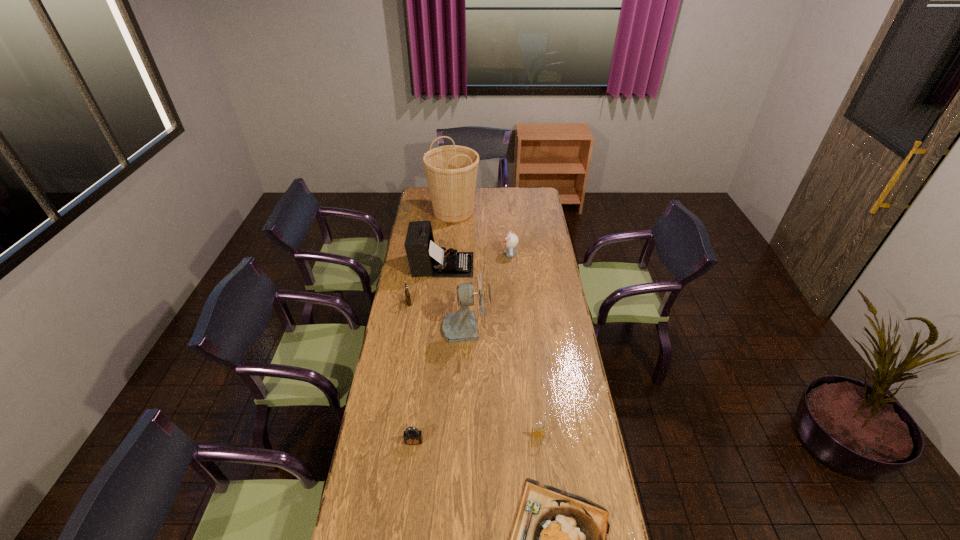
The image size is (960, 540). I want to click on typewriter positioned at the left edge, so click(425, 258).

This screenshot has height=540, width=960. In order to click on object that is at the far left corner in this screenshot , I will do `click(451, 170)`.

Where is `vacant region at the left edge`? Image resolution: width=960 pixels, height=540 pixels. vacant region at the left edge is located at coordinates (400, 467).

Identify the location of vacant space at the right edge. Image resolution: width=960 pixels, height=540 pixels. (528, 228).

At what (x,y) coordinates should I click in order to perform the action: click on free area in between the third tallest object and the fan. Please return your answer as a coordinate pair (x, y). This screenshot has width=960, height=540. Looking at the image, I should click on (454, 295).

Where is `empty space that is in between the rightmost padlock and the third tallest object`? empty space that is in between the rightmost padlock and the third tallest object is located at coordinates (490, 350).

I want to click on vacant space in between the farthest object and the typewriter, so click(x=448, y=239).

Locate an element on the screen. Image resolution: width=960 pixels, height=540 pixels. empty space that is in between the second padlock from left to right and the fifth shortest object is located at coordinates (462, 348).

Find the location of a particular element. blank region between the third tallest object and the fifth tallest object is located at coordinates (425, 284).

In order to click on the sixth closest object relative to the rightmost padlock in this screenshot , I will do `click(511, 240)`.